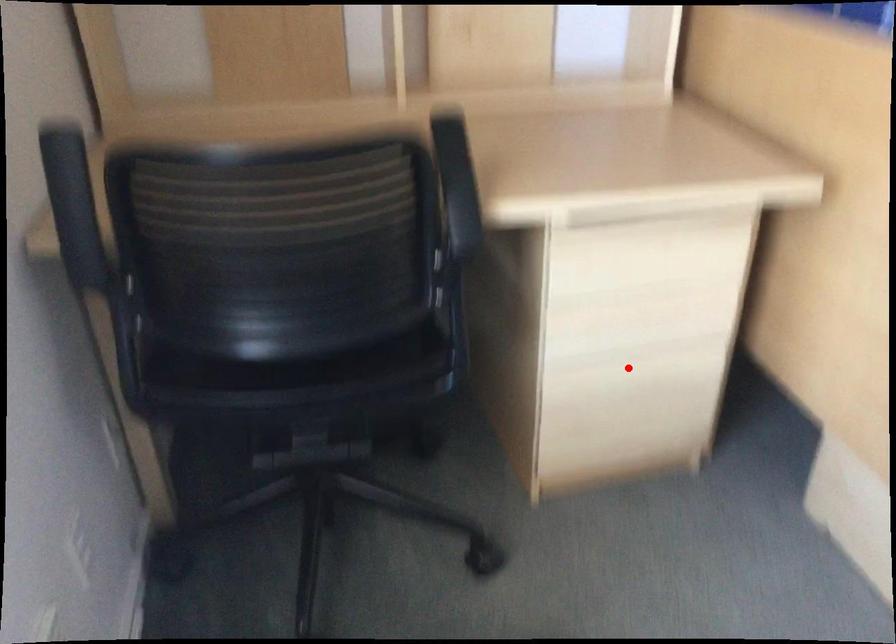
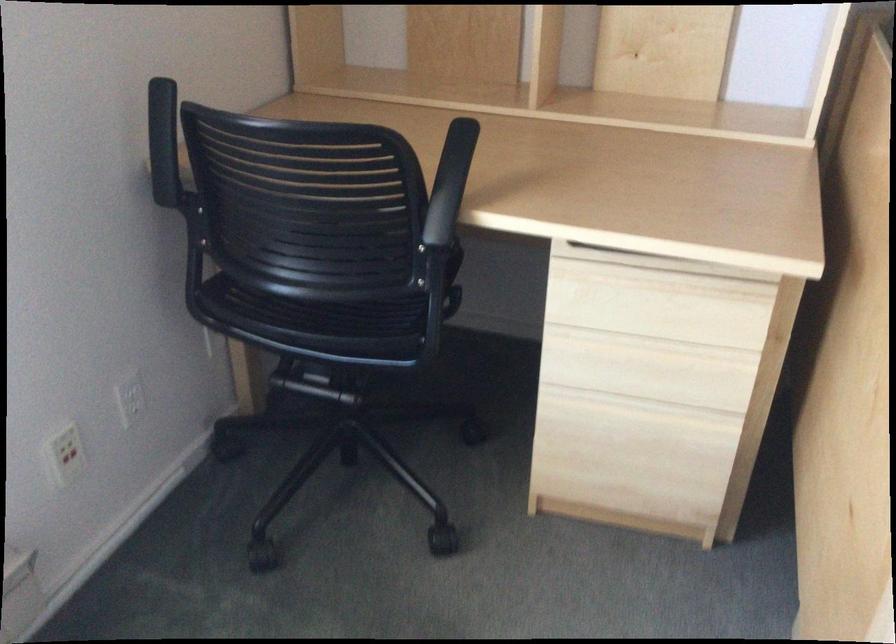
Locate, in the second image, the point that corresponds to the highlighted location in the first image.

(632, 409)